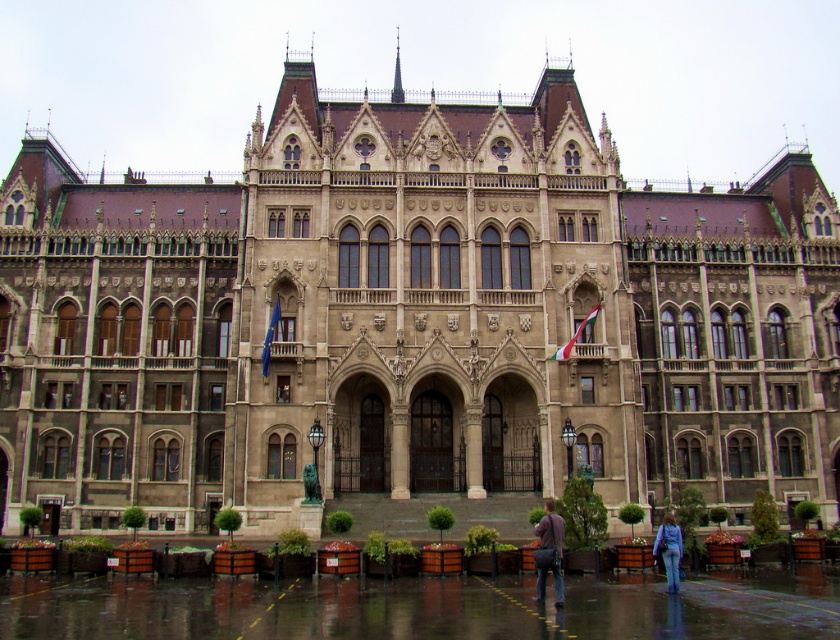
Question: Is the position of dark brown leather jacket at lower center more distant than that of purple fabric bag at lower right?

Choices:
 (A) no
 (B) yes

Answer: (A)

Question: Where is dark brown leather jacket at lower center located in relation to purple fabric bag at lower right in the image?

Choices:
 (A) right
 (B) left

Answer: (B)

Question: Which object is closer to the camera taking this photo?

Choices:
 (A) purple fabric bag at lower right
 (B) dark brown leather jacket at lower center

Answer: (B)

Question: Which object appears farthest from the camera in this image?

Choices:
 (A) purple fabric bag at lower right
 (B) dark brown leather jacket at lower center

Answer: (A)

Question: Does dark brown leather jacket at lower center appear on the left side of purple fabric bag at lower right?

Choices:
 (A) yes
 (B) no

Answer: (A)